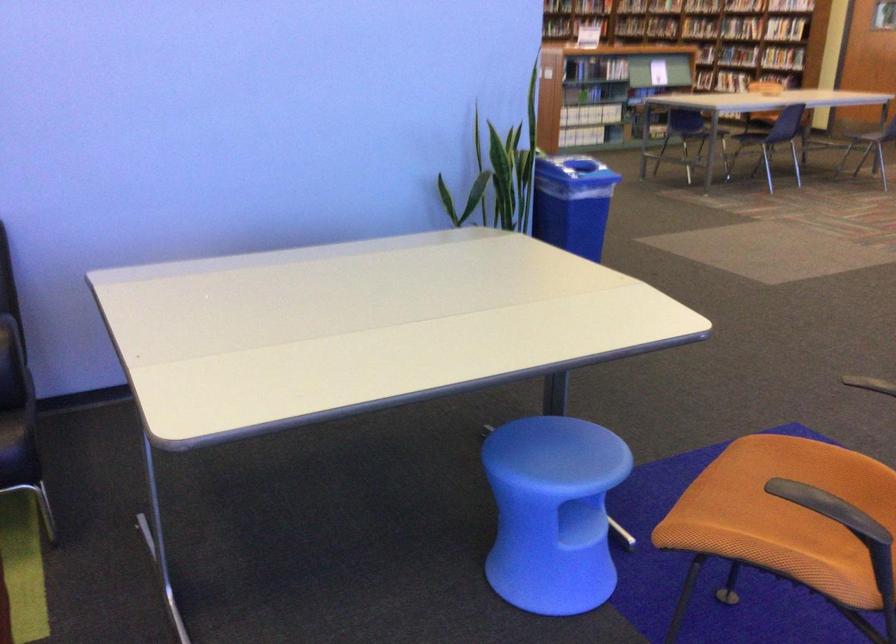
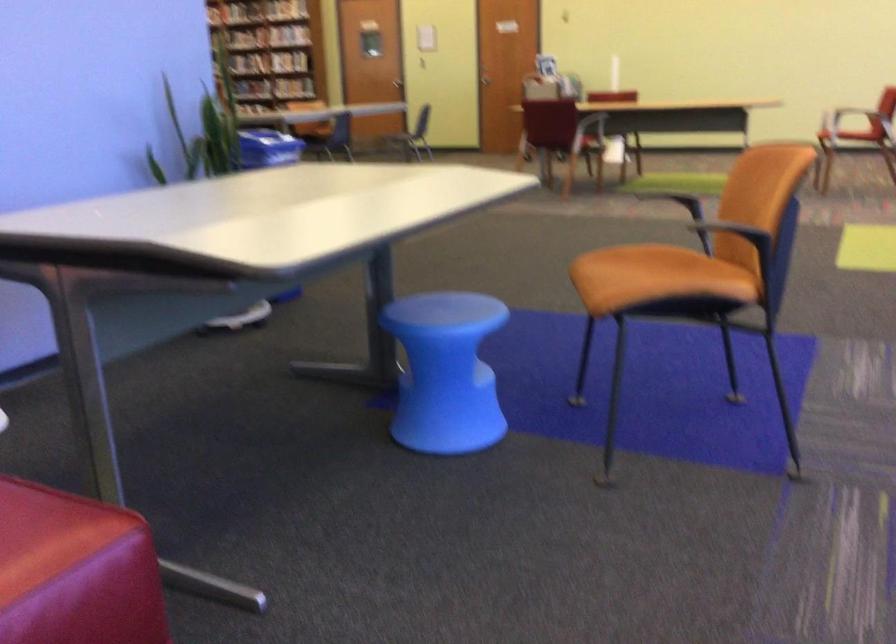
Question: I am providing you with two images of the same scene from different viewpoints. Please identify which objects are invisible in image2.

Choices:
 (A) orange chair sitting surface
 (B) red sofa sitting surface
 (C) purple mop handle
 (D) book on shelf

Answer: (D)